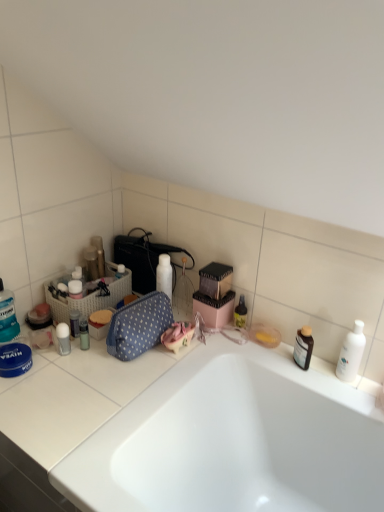
Question: Could you tell me if blue polka dot fabric bag at center is facing white woven laundry basket at left?

Choices:
 (A) yes
 (B) no

Answer: (B)

Question: Is blue polka dot fabric bag at center further to the viewer compared to white woven laundry basket at left?

Choices:
 (A) no
 (B) yes

Answer: (A)

Question: Does blue polka dot fabric bag at center come in front of white woven laundry basket at left?

Choices:
 (A) yes
 (B) no

Answer: (A)

Question: Does blue polka dot fabric bag at center have a larger size compared to white woven laundry basket at left?

Choices:
 (A) yes
 (B) no

Answer: (B)

Question: From a real-world perspective, is blue polka dot fabric bag at center located beneath white woven laundry basket at left?

Choices:
 (A) yes
 (B) no

Answer: (B)

Question: Is translucent plastic mouthwash at left, the first toiletry viewed from the left, taller or shorter than matte black speaker at upper left, the 6th toiletry positioned from the left?

Choices:
 (A) short
 (B) tall

Answer: (B)

Question: From the image's perspective, is translucent plastic mouthwash at left, which is counted as the tenth toiletry, starting from the right, above or below matte black speaker at upper left, the 6th toiletry positioned from the left?

Choices:
 (A) below
 (B) above

Answer: (A)

Question: Is translucent plastic mouthwash at left, the first toiletry viewed from the left, inside or outside of matte black speaker at upper left, the 5th toiletry in the right-to-left sequence?

Choices:
 (A) inside
 (B) outside

Answer: (B)

Question: From a real-world perspective, is translucent plastic mouthwash at left, which is counted as the tenth toiletry, starting from the right, above or below matte black speaker at upper left, the 6th toiletry positioned from the left?

Choices:
 (A) below
 (B) above

Answer: (A)

Question: From a real-world perspective, relative to translucent plastic tube at left, which appears as the 8th toiletry when viewed from the right, is blue polka dot fabric bag at center vertically above or below?

Choices:
 (A) below
 (B) above

Answer: (B)

Question: Considering the positions of blue polka dot fabric bag at center and translucent plastic tube at left, the 3th toiletry in the left-to-right sequence, in the image, is blue polka dot fabric bag at center bigger or smaller than translucent plastic tube at left, the 3th toiletry in the left-to-right sequence,?

Choices:
 (A) small
 (B) big

Answer: (B)

Question: Is point (135, 354) positioned closer to the camera than point (74, 309)?

Choices:
 (A) farther
 (B) closer

Answer: (B)

Question: Which is correct: blue polka dot fabric bag at center is inside translucent plastic tube at left, the 3th toiletry in the left-to-right sequence, or outside of it?

Choices:
 (A) outside
 (B) inside

Answer: (A)

Question: Is translucent plastic tube at left, which appears as the 8th toiletry when viewed from the right, inside or outside of blue polka dot fabric bag at center?

Choices:
 (A) outside
 (B) inside

Answer: (A)

Question: In terms of height, does translucent plastic tube at left, the 3th toiletry in the left-to-right sequence, look taller or shorter compared to blue polka dot fabric bag at center?

Choices:
 (A) tall
 (B) short

Answer: (B)